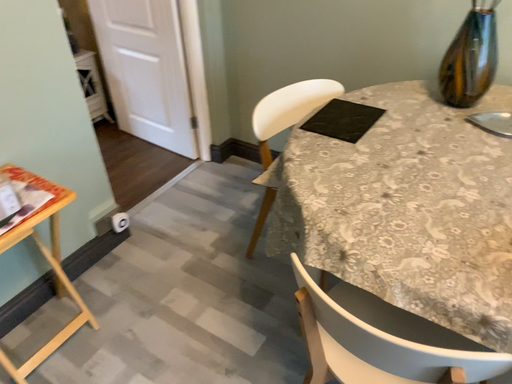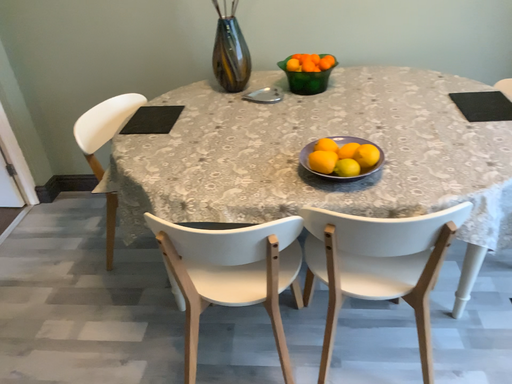
Question: Which way did the camera rotate in the video?

Choices:
 (A) rotated downward
 (B) rotated upward

Answer: (B)